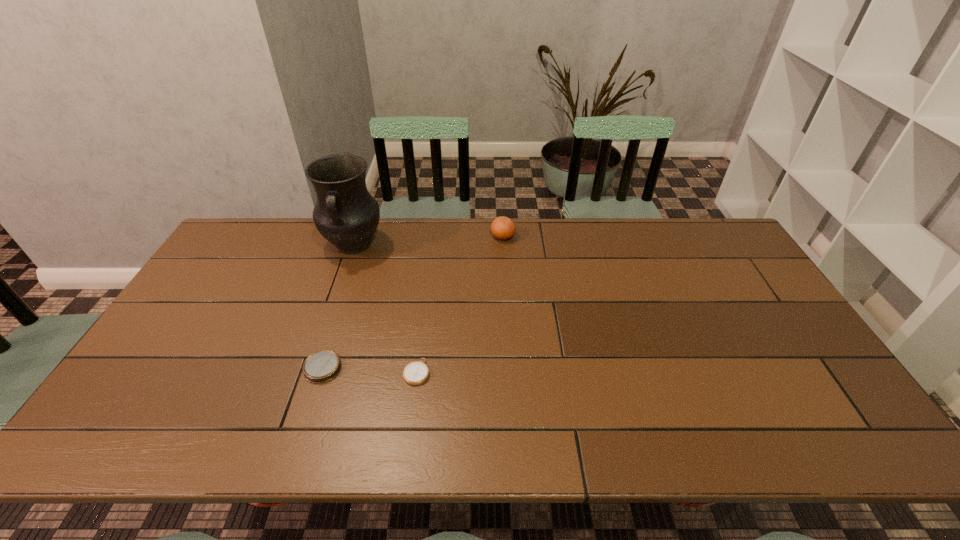
Locate an element on the screen. This screenshot has height=540, width=960. free spot that satisfies the following two spatial constraints: 1. on the handle side of the shorter compass; 2. on the right side of the pitcher is located at coordinates (310, 372).

The width and height of the screenshot is (960, 540). I want to click on vacant area in the image that satisfies the following two spatial constraints: 1. on the handle side of the tallest object; 2. on the left side of the taller compass, so click(311, 368).

Identify the location of blank space that satisfies the following two spatial constraints: 1. on the handle side of the second object from right to left; 2. on the left side of the pitcher. The image size is (960, 540). (310, 372).